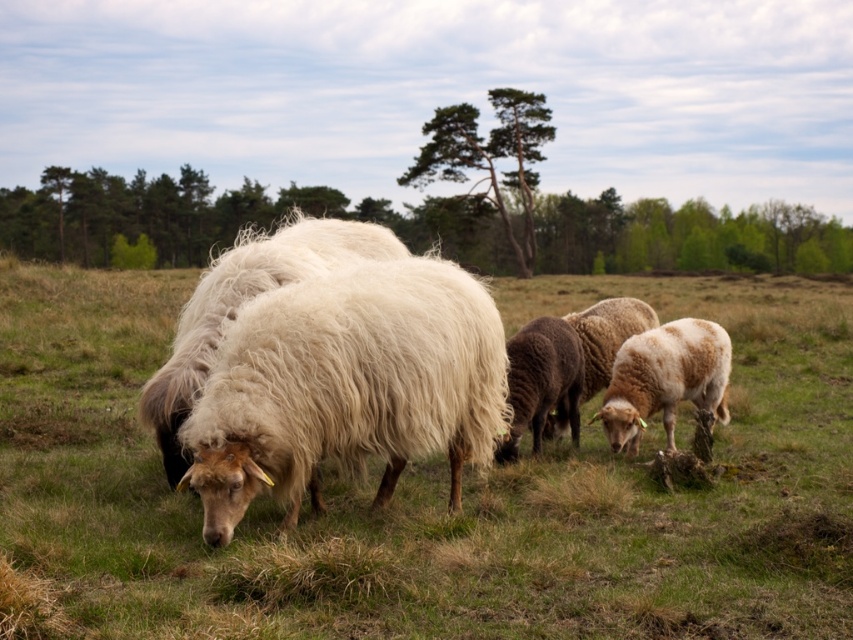
You are a farmer checking the health of your flock. You notice two sheep at the center of the field. Which one is taller between the fuzzy white sheep at center and the white fluffy sheep at center?

The fuzzy white sheep at center is taller than the white fluffy sheep at center.

You are a photographer trying to capture a clear shot of the fuzzy white sheep at center and the white fluffy sheep at center. Which one will appear closer to the camera in the photo?

The fuzzy white sheep at center will appear closer to the camera because it is positioned in front of the white fluffy sheep at center.